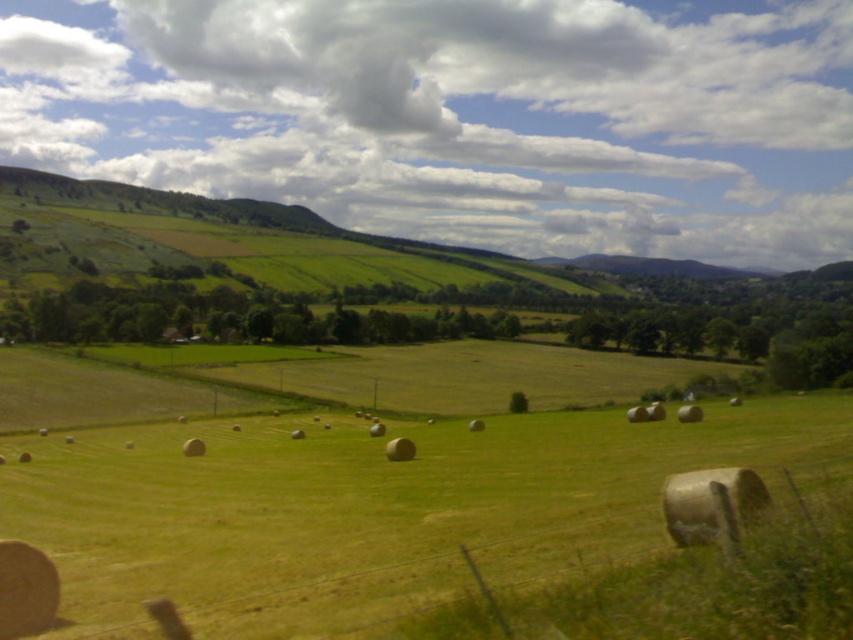
Between green grassy field at center and green grassy hillside at upper left, which one appears on the right side from the viewer's perspective?

From the viewer's perspective, green grassy field at center appears more on the right side.

Does green grassy field at center appear under green grassy hillside at upper left?

Yes, green grassy field at center is below green grassy hillside at upper left.

The width and height of the screenshot is (853, 640). What do you see at coordinates (372, 509) in the screenshot?
I see `green grassy field at center` at bounding box center [372, 509].

Identify the location of green grassy field at center. This screenshot has width=853, height=640. (372, 509).